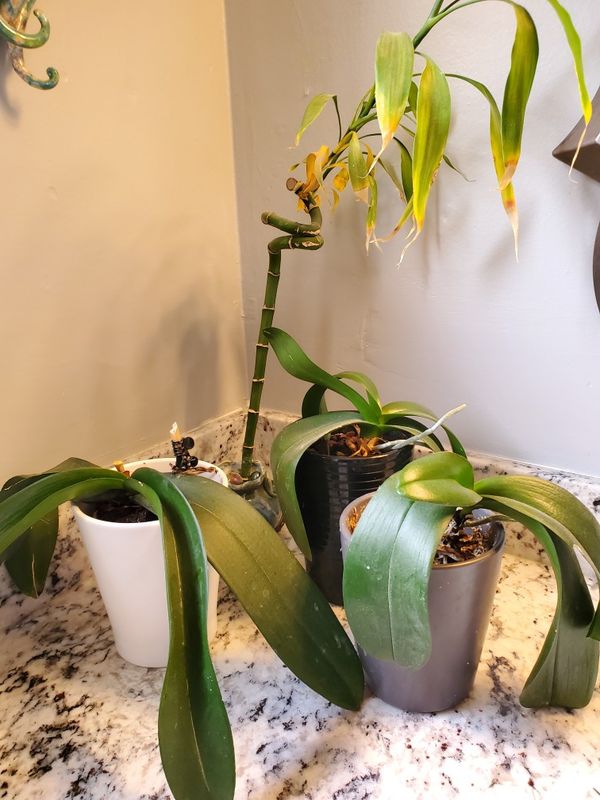
Find the location of a particular element. black pot is located at coordinates (321, 502).